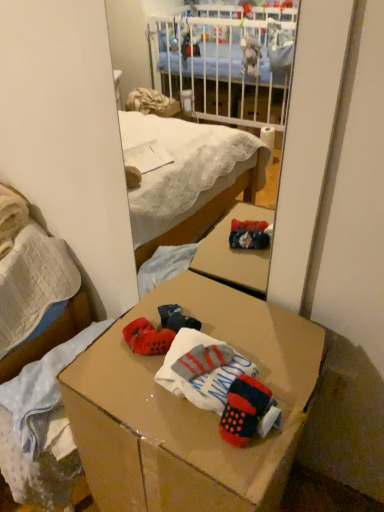
Locate an element on the screen. The image size is (384, 512). vacant space situated above cardboard box at center (from a real-world perspective) is located at coordinates (197, 362).